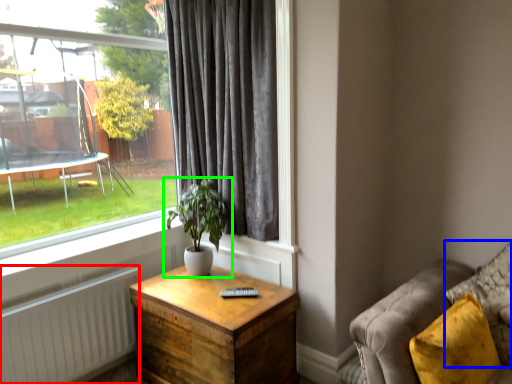
Question: Which object is the closest to the radiator (highlighted by a red box)? Choose among these: pillow (highlighted by a blue box) or houseplant (highlighted by a green box).

Choices:
 (A) pillow
 (B) houseplant

Answer: (B)